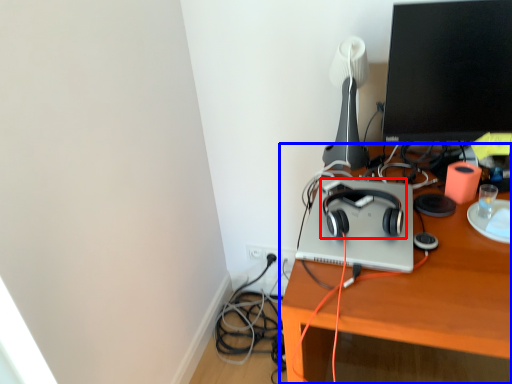
Question: Which point is closer to the camera, headphones (highlighted by a red box) or desk (highlighted by a blue box)?

Choices:
 (A) headphones
 (B) desk

Answer: (B)